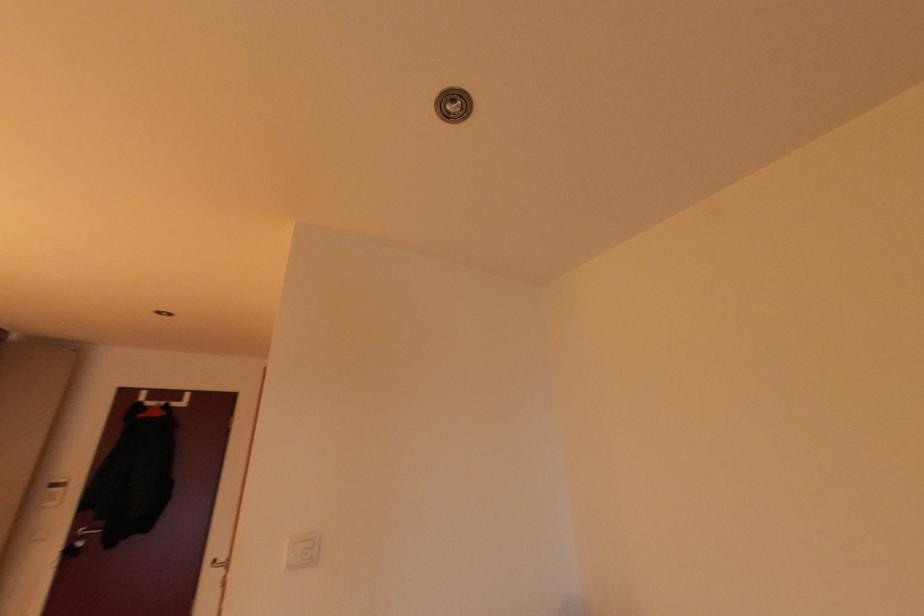
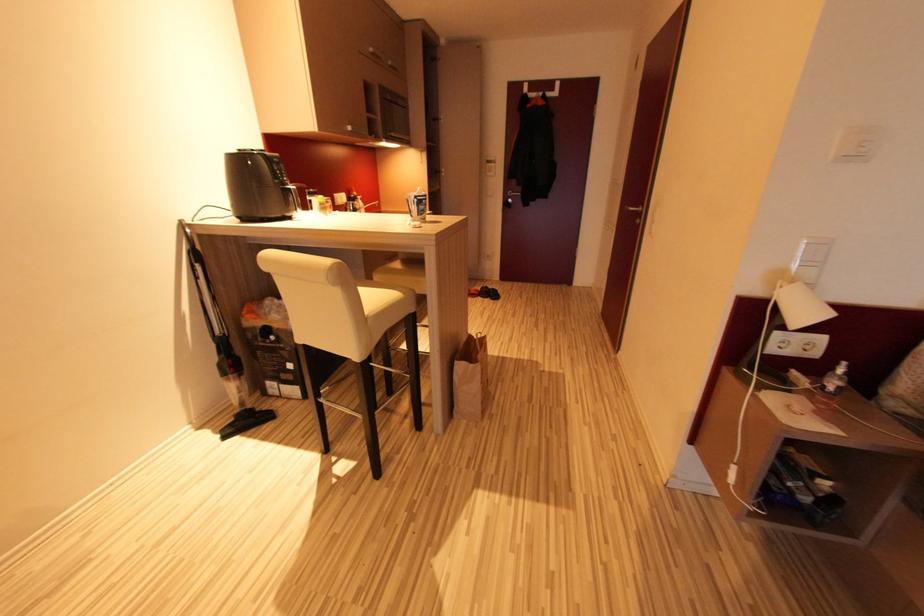
The first image is from the beginning of the video and the second image is from the end. How did the camera likely rotate when shooting the video?

The camera's rotation is toward left-down.